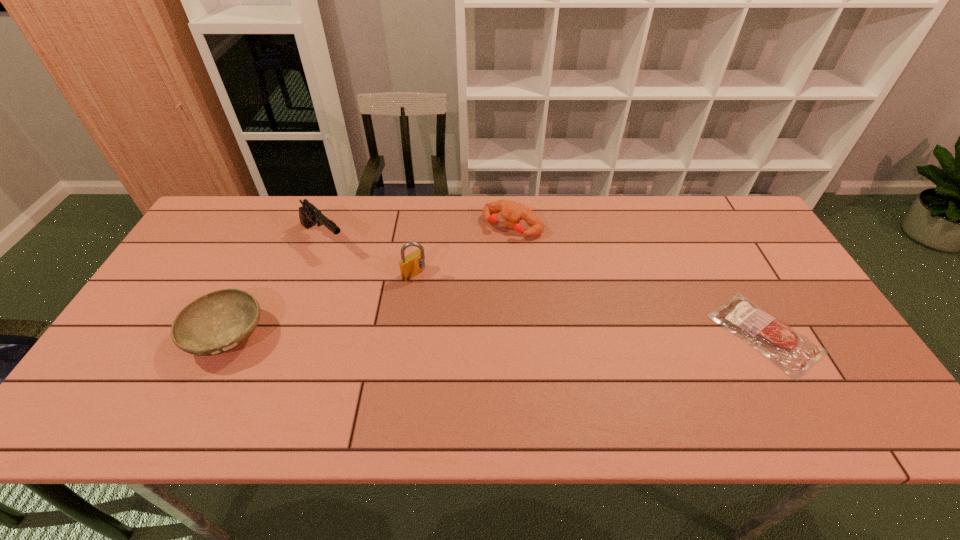
Find the location of a particular element. The width and height of the screenshot is (960, 540). vacant space located 0.170m on the side with the combination dials of the third farthest object is located at coordinates (467, 311).

The width and height of the screenshot is (960, 540). I want to click on free spot located on the side with the combination dials of the third farthest object, so click(x=474, y=317).

Locate an element on the screen. The image size is (960, 540). free space located 0.400m at the end of the barrel of the gun is located at coordinates (426, 329).

This screenshot has height=540, width=960. Find the location of `free point located 0.380m at the end of the barrel of the gun`. free point located 0.380m at the end of the barrel of the gun is located at coordinates (420, 325).

I want to click on vacant space located 0.240m at the end of the barrel of the gun, so click(388, 296).

At what (x,y) coordinates should I click in order to perform the action: click on blank area located with the gloves of the puncher facing forward. Please return your answer as a coordinate pair (x, y). This screenshot has height=540, width=960. Looking at the image, I should click on (457, 289).

At what (x,y) coordinates should I click in order to perform the action: click on vacant space located with the gloves of the puncher facing forward. Please return your answer as a coordinate pair (x, y). Looking at the image, I should click on (480, 261).

Locate an element on the screen. The width and height of the screenshot is (960, 540). free spot located 0.200m with the gloves of the puncher facing forward is located at coordinates (465, 280).

The image size is (960, 540). I want to click on gun located at the far edge, so click(x=309, y=215).

Identify the location of puncher located in the far edge section of the desktop. (512, 212).